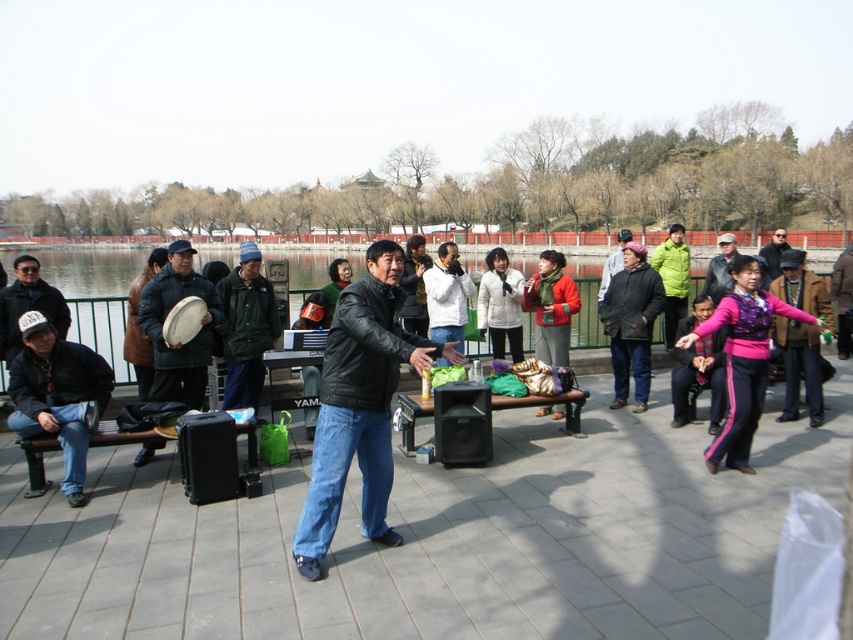
Question: Among these objects, which one is farthest from the camera?

Choices:
 (A) green matte jacket at center
 (B) matte black drum at left
 (C) matte black jacket at left

Answer: (A)

Question: Estimate the real-world distances between objects in this image. Which object is farther from the black leather jacket at center?

Choices:
 (A) leather jacket at center
 (B) green matte jacket at center

Answer: (A)

Question: Which of the following is the closest to the observer?

Choices:
 (A) matte black jacket at left
 (B) dark gray leather jacket at center
 (C) leather jacket at center
 (D) matte black drum at left

Answer: (A)

Question: Is matte black jacket at left further to the viewer compared to green matte jacket at center?

Choices:
 (A) yes
 (B) no

Answer: (B)

Question: Where is black leather jacket at center located in relation to matte black jacket at left in the image?

Choices:
 (A) right
 (B) left

Answer: (A)

Question: Can you confirm if matte black drum at left is positioned below leather jacket at center?

Choices:
 (A) yes
 (B) no

Answer: (A)